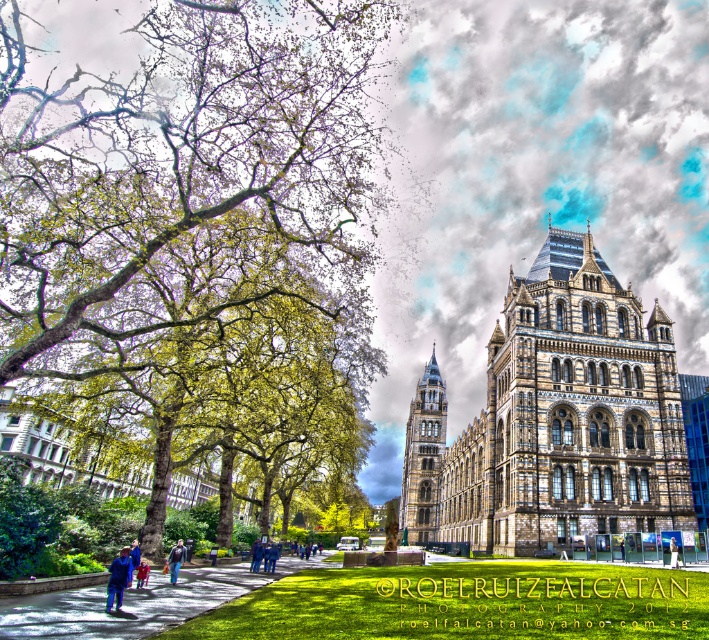
Question: Is blue fabric jacket at lower left in front of blue fabric person at center?

Choices:
 (A) yes
 (B) no

Answer: (A)

Question: Which of the following is the farthest from the observer?

Choices:
 (A) (145, 573)
 (B) (128, 548)

Answer: (B)

Question: Is brown stone church at center bigger than blue denim jeans at lower left?

Choices:
 (A) no
 (B) yes

Answer: (B)

Question: Where is brown stone church at center located in relation to blue denim jeans at center in the image?

Choices:
 (A) below
 (B) above

Answer: (B)

Question: Which of the following is the closest to the observer?

Choices:
 (A) brown stone church at center
 (B) green asphalt path at lower center
 (C) green leafy tree at center

Answer: (B)

Question: Which point is farther from the camera taking this photo?

Choices:
 (A) (238, 588)
 (B) (139, 580)

Answer: (A)